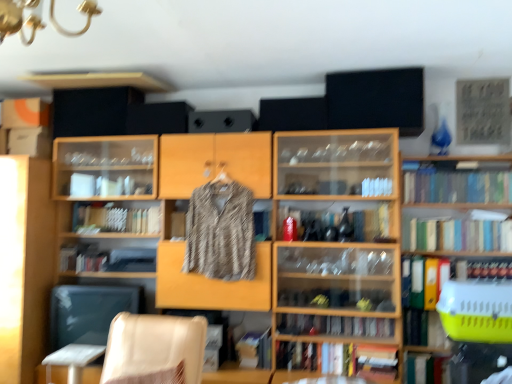
Question: In the image, is hardcover book at center, the third book when ordered from bottom to top, on the left side or the right side of green matte bookshelf at right, acting as the 8th book starting from the bottom?

Choices:
 (A) left
 (B) right

Answer: (A)

Question: Looking at the image, does hardcover book at center, the third book when ordered from bottom to top, seem bigger or smaller compared to green matte bookshelf at right, acting as the 8th book starting from the bottom?

Choices:
 (A) big
 (B) small

Answer: (B)

Question: Estimate the real-world distances between objects in this image. Which object is farther from the yellow plastic pet carrier at right, marked as the 1th shelf in a right-to-left arrangement?

Choices:
 (A) green matte book at lower right, which ranks as the fourth book in bottom-to-top order
 (B) wooden cabinet at left, positioned as the first shelf in left-to-right order
 (C) white plastic table at lower left
 (D) striped fabric shirt at center
 (E) beige leather chair at lower left

Answer: (B)

Question: Based on their relative distances, which object is nearer to the striped fabric shirt at center?

Choices:
 (A) green matte bookshelf at right, acting as the 1th book starting from the top
 (B) white plastic table at lower left
 (C) hardcover book at center, the third book when ordered from bottom to top
 (D) beige leather chair at lower left
 (E) hardcover book at right, arranged as the 3th book when viewed from the top

Answer: (D)